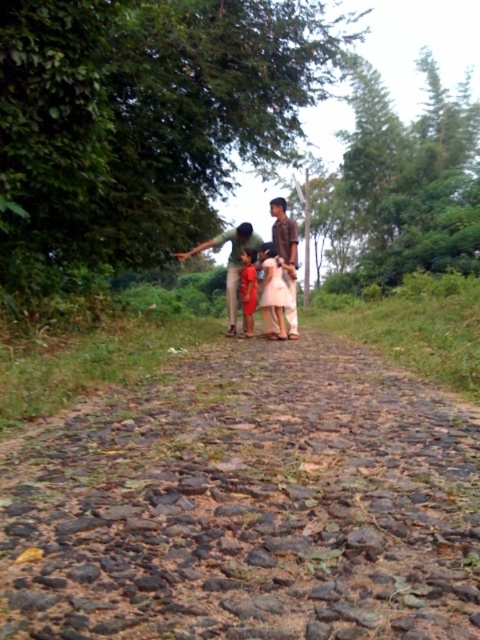
You are a photographer trying to capture a clear photo of both the white satin dress at center and the brown cotton shirt at center. Since you can only focus on one subject at a time, which one should you choose to ensure the other appears slightly blurred in the background?

You should focus on the white satin dress at center because it is closer to the viewer, making the brown cotton shirt at center appear blurred in the background when using a shallow depth of field.

You are part of the group walking on the brown gravel path at center. You notice the green matte shirt at center ahead of you. In which direction should you move to avoid stepping on the path?

The brown gravel path at center is positioned under the green matte shirt at center, so to avoid stepping on the path, you should move away from the direction of the green matte shirt at center towards the grassy areas on either side.

You are part of a group walking along a narrow cobblestone path in a rural area. You notice two people ahead of you wearing a green matte shirt at center and a matte red dress at center. Which one is closer to you?

The green matte shirt at center is closer to you because it is in front of the matte red dress at center.